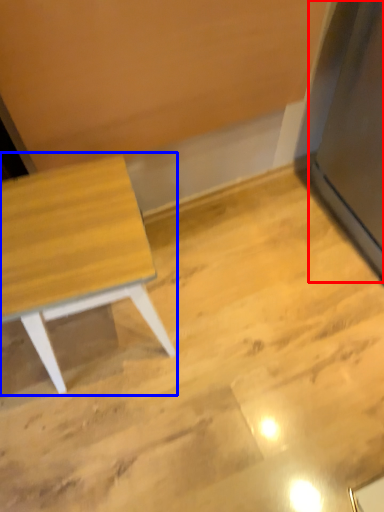
Question: Which object appears closest to the camera in this image, fridge (highlighted by a red box) or table (highlighted by a blue box)?

Choices:
 (A) fridge
 (B) table

Answer: (A)